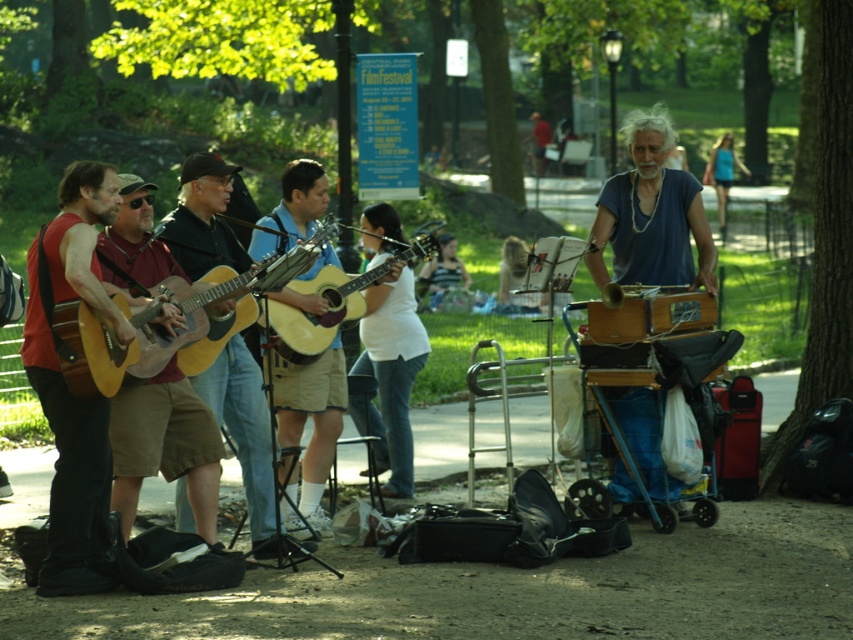
You are a photographer wanting to capture the two guitars at the center of the image. Which guitar is thinner between the wooden acoustic guitar at center and the acoustic wood guitar at center?

The wooden acoustic guitar at center is thinner than the acoustic wood guitar at center.

You are a photographer standing at the center of the park. You want to take a photo that includes both the point at (683, 204) and the point at (293, 289). Which point should you focus on first to ensure both are in focus?

You should focus on the point at (683, 204) first because it is closer to the camera than the point at (293, 289). This ensures that both points will be in focus since focusing on the closer object first allows the camera to capture the depth of field needed for the farther point.